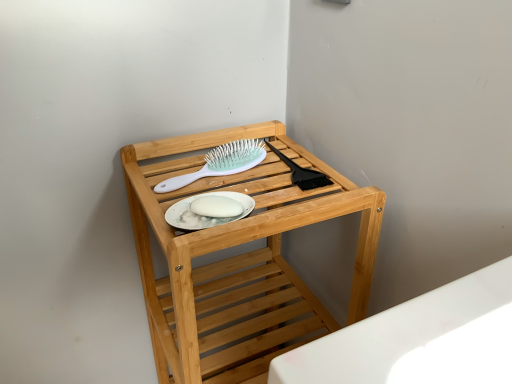
The height and width of the screenshot is (384, 512). What are the coordinates of `vacant space to the right of white plastic hairbrush at upper center` in the screenshot? It's located at (292, 187).